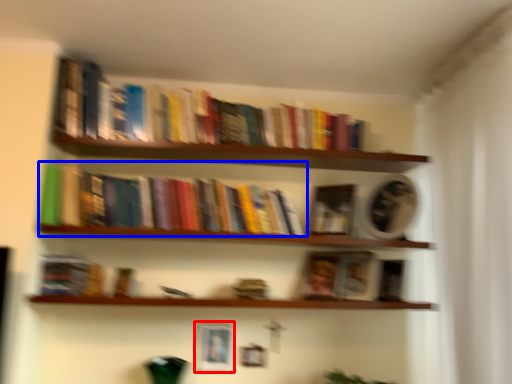
Question: Which of the following is the farthest to the observer, picture frame (highlighted by a red box) or book (highlighted by a blue box)?

Choices:
 (A) picture frame
 (B) book

Answer: (A)